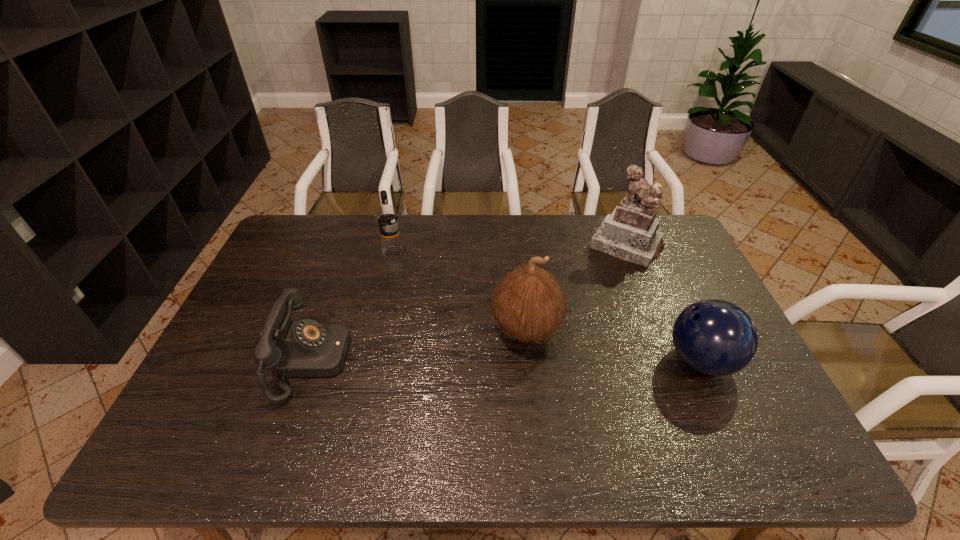
Where is `vodka that is at the far edge`? The height and width of the screenshot is (540, 960). vodka that is at the far edge is located at coordinates (387, 217).

At what (x,y) coordinates should I click in order to perform the action: click on figurine that is at the far edge. Please return your answer as a coordinate pair (x, y). The height and width of the screenshot is (540, 960). Looking at the image, I should click on (630, 233).

Locate an element on the screen. This screenshot has height=540, width=960. telephone at the near edge is located at coordinates (305, 348).

Where is `bowling ball located at the near edge`? Image resolution: width=960 pixels, height=540 pixels. bowling ball located at the near edge is located at coordinates (714, 337).

The height and width of the screenshot is (540, 960). I want to click on bowling ball that is at the right edge, so click(714, 337).

Locate an element on the screen. Image resolution: width=960 pixels, height=540 pixels. figurine present at the right edge is located at coordinates [x=630, y=233].

Find the location of `object present at the far right corner`. object present at the far right corner is located at coordinates (630, 233).

The width and height of the screenshot is (960, 540). I want to click on object present at the near right corner, so click(714, 337).

The width and height of the screenshot is (960, 540). I want to click on vacant area at the far edge of the desktop, so click(483, 225).

This screenshot has width=960, height=540. I want to click on vacant region at the left edge of the desktop, so click(219, 351).